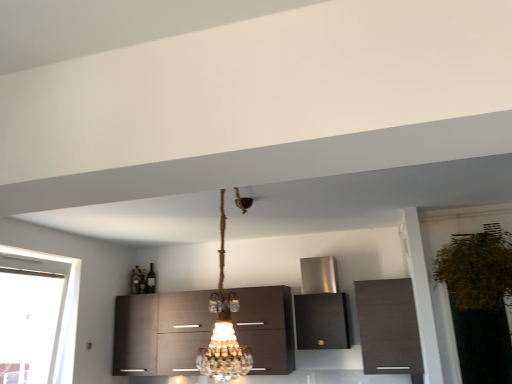
The height and width of the screenshot is (384, 512). What are the coordinates of `matte brown cabinet at upper right, which appears as the third cabinetry when viewed from the left` in the screenshot? It's located at (388, 327).

I want to click on dark wood cabinet at center, which ranks as the 1th cabinetry in left-to-right order, so click(x=161, y=332).

Where is `stainless steel range hood at center, the 2th cabinetry positioned from the right`? stainless steel range hood at center, the 2th cabinetry positioned from the right is located at coordinates (321, 321).

In order to face stainless steel range hood at center, positioned as the 2th cabinetry in left-to-right order, should I rotate leftwards or rightwards?

A 8.802 degree turn to the right will do.

The width and height of the screenshot is (512, 384). Identify the location of clear glass window at left. (63, 312).

What is the approximate height of crystal glass chandelier at center?

crystal glass chandelier at center is 98.25 centimeters in height.

Locate an element on the screen. The height and width of the screenshot is (384, 512). matte brown cabinet at upper right, the first cabinetry positioned from the right is located at coordinates (388, 327).

From the picture: Is stainless steel range hood at center, the 2th cabinetry positioned from the right, at the back of dark wood cabinet at center, marked as the third cabinetry in a right-to-left arrangement?

That's not correct — dark wood cabinet at center, marked as the third cabinetry in a right-to-left arrangement, is not looking away from stainless steel range hood at center, the 2th cabinetry positioned from the right.

Is point (262, 331) closer to camera compared to point (300, 341)?

No, (262, 331) is further to viewer.

Looking at this image, between dark wood cabinet at center, marked as the third cabinetry in a right-to-left arrangement, and stainless steel range hood at center, positioned as the 2th cabinetry in left-to-right order, which one has smaller width?

dark wood cabinet at center, marked as the third cabinetry in a right-to-left arrangement.

Is dark wood cabinet at center, marked as the third cabinetry in a right-to-left arrangement, positioned far away from matte brown cabinet at upper right, the first cabinetry positioned from the right?

dark wood cabinet at center, marked as the third cabinetry in a right-to-left arrangement, is far away from matte brown cabinet at upper right, the first cabinetry positioned from the right.

From the image's perspective, is dark wood cabinet at center, which ranks as the 1th cabinetry in left-to-right order, located above matte brown cabinet at upper right, the first cabinetry positioned from the right?

No, from the image's perspective, dark wood cabinet at center, which ranks as the 1th cabinetry in left-to-right order, is not on top of matte brown cabinet at upper right, the first cabinetry positioned from the right.

How much distance is there between dark wood cabinet at center, which ranks as the 1th cabinetry in left-to-right order, and matte brown cabinet at upper right, the first cabinetry positioned from the right?

The distance of dark wood cabinet at center, which ranks as the 1th cabinetry in left-to-right order, from matte brown cabinet at upper right, the first cabinetry positioned from the right, is 5.30 feet.

Which object is wider, dark wood cabinet at center, marked as the third cabinetry in a right-to-left arrangement, or matte brown cabinet at upper right, which appears as the third cabinetry when viewed from the left?

Wider between the two is dark wood cabinet at center, marked as the third cabinetry in a right-to-left arrangement.

Between clear glass window at left and crystal glass chandelier at center, which one is positioned in front?

crystal glass chandelier at center is closer to the camera.

Based on the photo, which is more distant, (66, 309) or (228, 380)?

Point (66, 309)

Find the location of a particular element. Image resolution: width=512 pixels, height=384 pixels. lamp above the clear glass window at left (from the image's perspective) is located at coordinates (223, 329).

Where is `cabinetry that is the 2nd object to the right of the clear glass window at left, starting at the anchor`? The width and height of the screenshot is (512, 384). cabinetry that is the 2nd object to the right of the clear glass window at left, starting at the anchor is located at coordinates (321, 321).

Is stainless steel range hood at center, positioned as the 2th cabinetry in left-to-right order, completely or partially outside of clear glass window at left?

stainless steel range hood at center, positioned as the 2th cabinetry in left-to-right order, lies outside clear glass window at left's area.

From the image's perspective, is stainless steel range hood at center, the 2th cabinetry positioned from the right, on clear glass window at left?

Yes, from the image's perspective, stainless steel range hood at center, the 2th cabinetry positioned from the right, is above clear glass window at left.

What's the angular difference between stainless steel range hood at center, the 2th cabinetry positioned from the right, and clear glass window at left's facing directions?

They differ by 90 degrees in their facing directions.

In the scene shown: Considering their positions, is stainless steel range hood at center, positioned as the 2th cabinetry in left-to-right order, located in front of or behind crystal glass chandelier at center?

stainless steel range hood at center, positioned as the 2th cabinetry in left-to-right order, is positioned farther from the viewer than crystal glass chandelier at center.

How different are the orientations of stainless steel range hood at center, positioned as the 2th cabinetry in left-to-right order, and crystal glass chandelier at center in degrees?

9.93 degrees separate the facing orientations of stainless steel range hood at center, positioned as the 2th cabinetry in left-to-right order, and crystal glass chandelier at center.

Is stainless steel range hood at center, positioned as the 2th cabinetry in left-to-right order, facing towards crystal glass chandelier at center?

Yes, stainless steel range hood at center, positioned as the 2th cabinetry in left-to-right order, faces towards crystal glass chandelier at center.

Does dark wood cabinet at center, marked as the third cabinetry in a right-to-left arrangement, have a greater width compared to crystal glass chandelier at center?

No, dark wood cabinet at center, marked as the third cabinetry in a right-to-left arrangement, is not wider than crystal glass chandelier at center.

Is dark wood cabinet at center, which ranks as the 1th cabinetry in left-to-right order, taller or shorter than crystal glass chandelier at center?

Clearly, dark wood cabinet at center, which ranks as the 1th cabinetry in left-to-right order, is shorter compared to crystal glass chandelier at center.

What's the angular difference between dark wood cabinet at center, marked as the third cabinetry in a right-to-left arrangement, and crystal glass chandelier at center's facing directions?

The angular difference between dark wood cabinet at center, marked as the third cabinetry in a right-to-left arrangement, and crystal glass chandelier at center is 10.2 degrees.

Who is smaller, dark wood cabinet at center, which ranks as the 1th cabinetry in left-to-right order, or crystal glass chandelier at center?

crystal glass chandelier at center.

Which of these two, crystal glass chandelier at center or stainless steel range hood at center, positioned as the 2th cabinetry in left-to-right order, is wider?

Wider between the two is crystal glass chandelier at center.

Is the depth of crystal glass chandelier at center greater than that of stainless steel range hood at center, the 2th cabinetry positioned from the right?

No, crystal glass chandelier at center is closer to the camera.

Could stainless steel range hood at center, positioned as the 2th cabinetry in left-to-right order, be considered to be inside crystal glass chandelier at center?

Definitely not — stainless steel range hood at center, positioned as the 2th cabinetry in left-to-right order, is not inside crystal glass chandelier at center.

Locate an element on the screen. Image resolution: width=512 pixels, height=384 pixels. cabinetry behind the stainless steel range hood at center, the 2th cabinetry positioned from the right is located at coordinates (161, 332).

In the image, there is a matte brown cabinet at upper right, which appears as the third cabinetry when viewed from the left. Where is `cabinetry below it (from the image's perspective)`? cabinetry below it (from the image's perspective) is located at coordinates (161, 332).

Based on their spatial positions, is crystal glass chandelier at center or stainless steel range hood at center, the 2th cabinetry positioned from the right, further from green leafy plant at right?

crystal glass chandelier at center lies further to green leafy plant at right than the other object.

Estimate the real-world distances between objects in this image. Which object is closer to stainless steel range hood at center, positioned as the 2th cabinetry in left-to-right order, crystal glass chandelier at center or clear glass window at left?

crystal glass chandelier at center.

When comparing their distances from crystal glass chandelier at center, does stainless steel range hood at center, the 2th cabinetry positioned from the right, or green leafy plant at right seem further?

green leafy plant at right.

Based on their spatial positions, is dark wood cabinet at center, which ranks as the 1th cabinetry in left-to-right order, or green leafy plant at right further from matte brown cabinet at upper right, the first cabinetry positioned from the right?

dark wood cabinet at center, which ranks as the 1th cabinetry in left-to-right order, lies further to matte brown cabinet at upper right, the first cabinetry positioned from the right, than the other object.

When comparing their distances from clear glass window at left, does crystal glass chandelier at center or dark wood cabinet at center, which ranks as the 1th cabinetry in left-to-right order, seem closer?

dark wood cabinet at center, which ranks as the 1th cabinetry in left-to-right order, is closer to clear glass window at left.

Considering their positions, is dark wood cabinet at center, marked as the third cabinetry in a right-to-left arrangement, positioned further to green leafy plant at right than crystal glass chandelier at center?

dark wood cabinet at center, marked as the third cabinetry in a right-to-left arrangement, lies further to green leafy plant at right than the other object.

Estimate the real-world distances between objects in this image. Which object is closer to stainless steel range hood at center, positioned as the 2th cabinetry in left-to-right order, green leafy plant at right or clear glass window at left?

green leafy plant at right.

When comparing their distances from green leafy plant at right, does matte brown cabinet at upper right, the first cabinetry positioned from the right, or dark wood cabinet at center, marked as the third cabinetry in a right-to-left arrangement, seem closer?

matte brown cabinet at upper right, the first cabinetry positioned from the right.

I want to click on cabinetry located between clear glass window at left and stainless steel range hood at center, the 2th cabinetry positioned from the right, in the left-right direction, so click(x=161, y=332).

You are a GUI agent. You are given a task and a screenshot of the screen. Output one action in this format:
    pyautogui.click(x=<x>, y=<y>)
    Task: Click on the plant between crystal glass chandelier at center and stainless steel range hood at center, the 2th cabinetry positioned from the right, in the front-back direction
    
    Given the screenshot: What is the action you would take?
    pyautogui.click(x=476, y=269)

Locate an element on the screen. The width and height of the screenshot is (512, 384). lamp located between clear glass window at left and matte brown cabinet at upper right, the first cabinetry positioned from the right, in the left-right direction is located at coordinates (223, 329).

Find the location of a particular element. Image resolution: width=512 pixels, height=384 pixels. cabinetry located between stainless steel range hood at center, positioned as the 2th cabinetry in left-to-right order, and green leafy plant at right in the left-right direction is located at coordinates (388, 327).